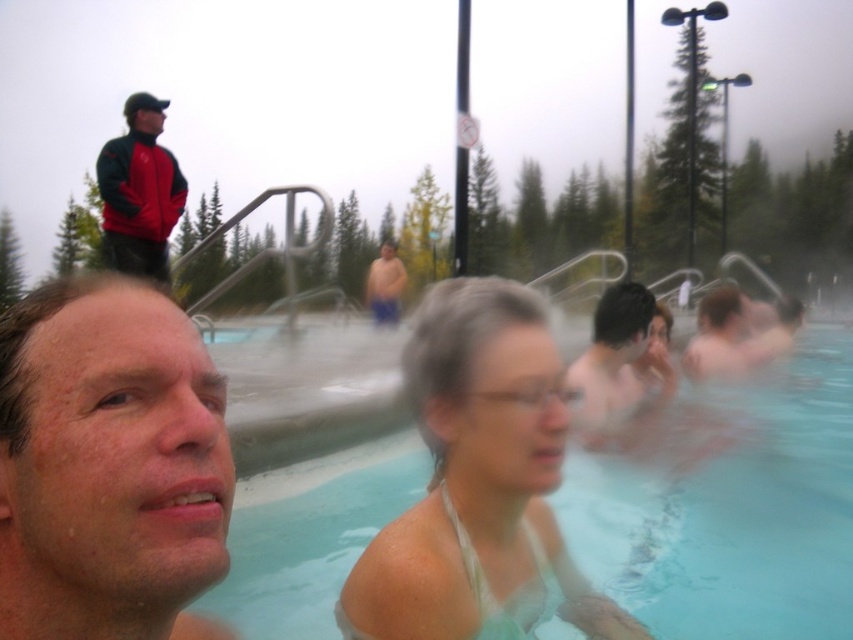
Question: Is dry skin face at center above white fabric at center?

Choices:
 (A) yes
 (B) no

Answer: (A)

Question: Is dry skin face at center thinner than white fabric at center?

Choices:
 (A) yes
 (B) no

Answer: (A)

Question: Which object appears farthest from the camera in this image?

Choices:
 (A) clear plastic water at center
 (B) smooth skin man at center
 (C) white fabric at center

Answer: (B)

Question: Is clear plastic water at center wider than smooth skin man at center?

Choices:
 (A) yes
 (B) no

Answer: (B)

Question: Which point is farther from the camera taking this photo?

Choices:
 (A) (386, 292)
 (B) (53, 593)
 (C) (115, 170)
 (D) (485, 548)

Answer: (A)

Question: Which of these objects is positioned farthest from the red fleece jacket at upper left?

Choices:
 (A) blue fabric shorts at center
 (B) white fabric at center

Answer: (A)